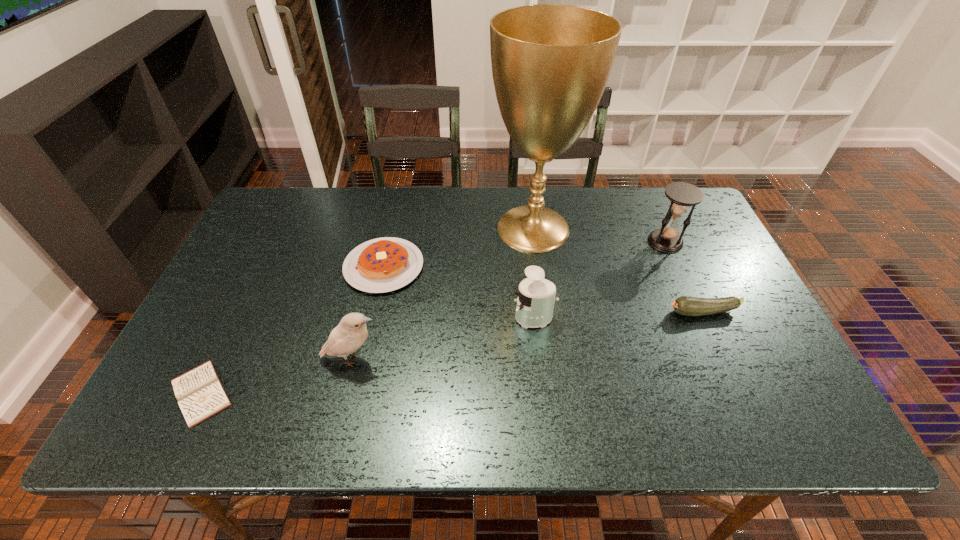
Locate an element on the screen. free region located 0.280m on the back of the juicer is located at coordinates (525, 237).

The width and height of the screenshot is (960, 540). In order to click on free spot located 0.380m at the beak of the bird in this screenshot , I will do `click(547, 359)`.

The image size is (960, 540). I want to click on vacant space located at the blossom end of the zucchini, so click(583, 313).

In order to click on free location located 0.090m at the blossom end of the zucchini in this screenshot , I will do `click(630, 313)`.

Where is `free space located at the blossom end of the zucchini`? free space located at the blossom end of the zucchini is located at coordinates (536, 313).

Locate an element on the screen. blank space located on the back of the pancake is located at coordinates (395, 215).

In order to click on free space located on the right of the shortest object in this screenshot , I will do `click(301, 393)`.

Where is `trophy cup that is at the far edge`? The image size is (960, 540). trophy cup that is at the far edge is located at coordinates (551, 63).

Where is `hourglass present at the far edge`? This screenshot has height=540, width=960. hourglass present at the far edge is located at coordinates (682, 195).

Find the location of a particular element. This screenshot has height=540, width=960. object that is at the near edge is located at coordinates (200, 394).